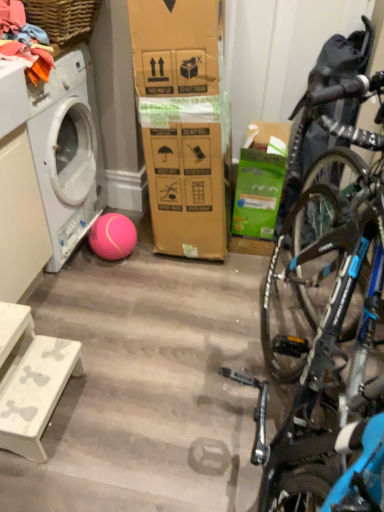
Question: Are soft cotton clothes at upper left and green cardboard box at center-right beside each other?

Choices:
 (A) yes
 (B) no

Answer: (B)

Question: Is green cardboard box at center-right at the back of soft cotton clothes at upper left?

Choices:
 (A) no
 (B) yes

Answer: (A)

Question: Does soft cotton clothes at upper left have a lesser width compared to green cardboard box at center-right?

Choices:
 (A) yes
 (B) no

Answer: (A)

Question: Could you tell me if soft cotton clothes at upper left is turned towards green cardboard box at center-right?

Choices:
 (A) no
 (B) yes

Answer: (A)

Question: Can you confirm if soft cotton clothes at upper left is bigger than green cardboard box at center-right?

Choices:
 (A) yes
 (B) no

Answer: (B)

Question: From a real-world perspective, is soft cotton clothes at upper left under green cardboard box at center-right?

Choices:
 (A) no
 (B) yes

Answer: (A)

Question: Does white marble step stool at lower left have a lesser height compared to woven wood picnic basket at upper left?

Choices:
 (A) yes
 (B) no

Answer: (B)

Question: Is white marble step stool at lower left in contact with woven wood picnic basket at upper left?

Choices:
 (A) yes
 (B) no

Answer: (B)

Question: Is white marble step stool at lower left bigger than woven wood picnic basket at upper left?

Choices:
 (A) yes
 (B) no

Answer: (A)

Question: From a real-world perspective, is white marble step stool at lower left below woven wood picnic basket at upper left?

Choices:
 (A) yes
 (B) no

Answer: (A)

Question: Is white marble step stool at lower left surrounding woven wood picnic basket at upper left?

Choices:
 (A) yes
 (B) no

Answer: (B)

Question: From the image's perspective, would you say white marble step stool at lower left is shown under woven wood picnic basket at upper left?

Choices:
 (A) no
 (B) yes

Answer: (B)

Question: Can you confirm if soft cotton clothes at upper left is taller than woven wood picnic basket at upper left?

Choices:
 (A) yes
 (B) no

Answer: (A)